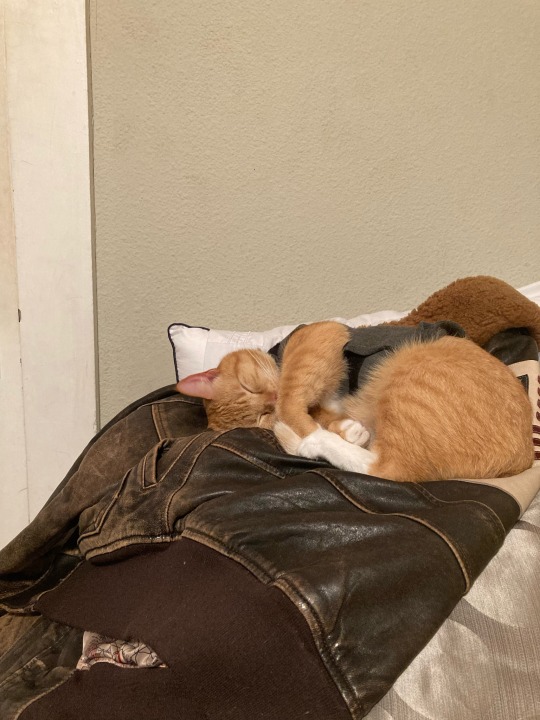
Locate an element on the screen. The width and height of the screenshot is (540, 720). corner is located at coordinates (119, 302).